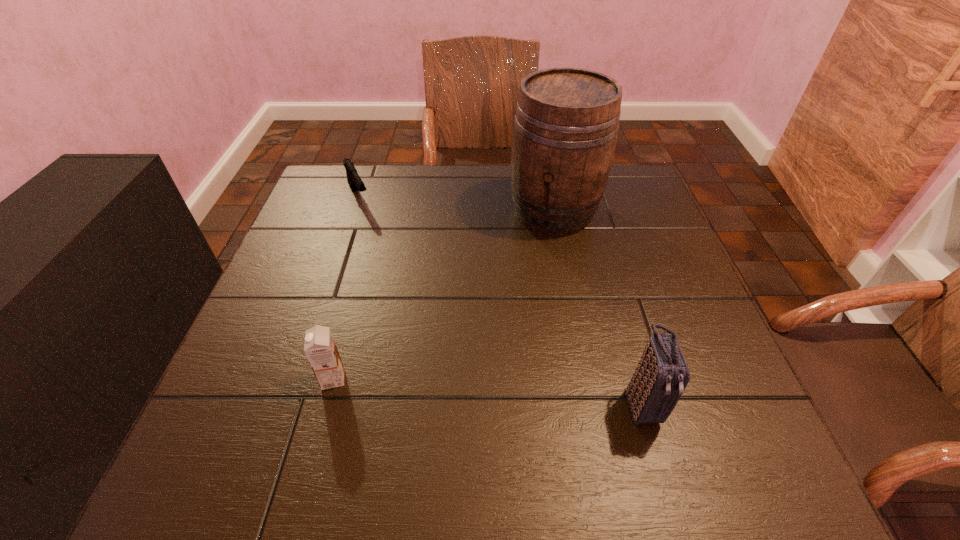
You are a GUI agent. You are given a task and a screenshot of the screen. Output one action in this format:
    pyautogui.click(x=<x>, y=<y>)
    Task: Click on the free space on the desktop that is between the third tallest object and the clutch bag and is positioned on the side of the cider near the bung hole
    The width and height of the screenshot is (960, 540).
    Given the screenshot: What is the action you would take?
    pyautogui.click(x=470, y=390)

Image resolution: width=960 pixels, height=540 pixels. Find the location of `vacant space on the desktop that is between the third tallest object and the clutch bag and is positioned on the front-facing side of the shortest object`. vacant space on the desktop that is between the third tallest object and the clutch bag and is positioned on the front-facing side of the shortest object is located at coordinates (470, 390).